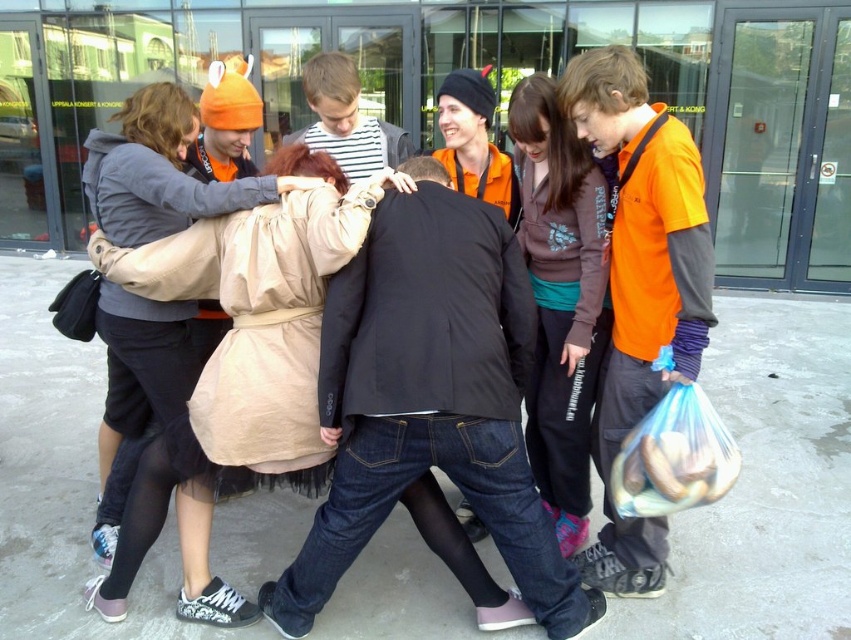
Can you confirm if beige fabric coat at left is shorter than brown fleece jacket at center?

A: Indeed, beige fabric coat at left has a lesser height compared to brown fleece jacket at center.

Is beige fabric coat at left thinner than brown fleece jacket at center?

No.

The image size is (851, 640). Describe the element at coordinates (158, 172) in the screenshot. I see `beige fabric coat at left` at that location.

At what (x,y) coordinates should I click in order to perform the action: click on beige fabric coat at left. Please return your answer as a coordinate pair (x, y). This screenshot has height=640, width=851. Looking at the image, I should click on (158, 172).

Which is behind, point (118, 401) or point (677, 509)?

The point (118, 401) is behind.

Does point (136, 214) lie in front of point (650, 488)?

No, (136, 214) is further to viewer.

What do you see at coordinates (158, 172) in the screenshot? This screenshot has height=640, width=851. I see `beige fabric coat at left` at bounding box center [158, 172].

Find the location of a particular element. beige fabric coat at left is located at coordinates tap(158, 172).

Which is in front, point (541, 388) or point (647, 420)?

Positioned in front is point (647, 420).

Where is `brown fleece jacket at center`? This screenshot has height=640, width=851. brown fleece jacket at center is located at coordinates (560, 298).